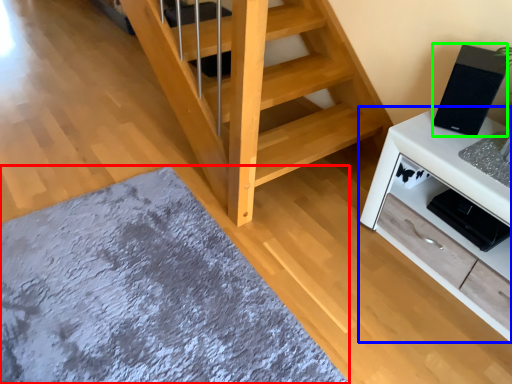
Question: Which object is the farthest from mat (highlighted by a red box)? Choose among these: cabinetry (highlighted by a blue box) or appliance (highlighted by a green box).

Choices:
 (A) cabinetry
 (B) appliance

Answer: (B)